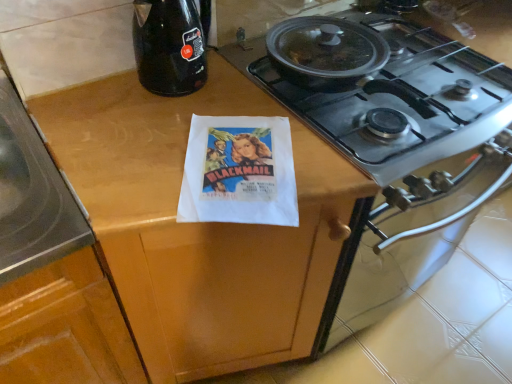
Question: Is black glass bottle at upper left outside wooden at center?

Choices:
 (A) no
 (B) yes

Answer: (B)

Question: Does black glass bottle at upper left have a lesser height compared to wooden at center?

Choices:
 (A) yes
 (B) no

Answer: (A)

Question: Is black glass bottle at upper left in contact with wooden at center?

Choices:
 (A) no
 (B) yes

Answer: (A)

Question: From the image's perspective, is black glass bottle at upper left on wooden at center?

Choices:
 (A) no
 (B) yes

Answer: (B)

Question: Considering the relative positions of black glass bottle at upper left and wooden at center in the image provided, is black glass bottle at upper left to the left of wooden at center from the viewer's perspective?

Choices:
 (A) yes
 (B) no

Answer: (A)

Question: Is black glass bottle at upper left in front of or behind stainless steel gas stove at upper right in the image?

Choices:
 (A) front
 (B) behind

Answer: (B)

Question: Is black glass bottle at upper left inside or outside of stainless steel gas stove at upper right?

Choices:
 (A) inside
 (B) outside

Answer: (B)

Question: In terms of width, does black glass bottle at upper left look wider or thinner when compared to stainless steel gas stove at upper right?

Choices:
 (A) thin
 (B) wide

Answer: (A)

Question: Based on their sizes in the image, would you say black glass bottle at upper left is bigger or smaller than stainless steel gas stove at upper right?

Choices:
 (A) small
 (B) big

Answer: (A)

Question: Considering the positions of black glass bottle at upper left and white paper flyer at center in the image, is black glass bottle at upper left wider or thinner than white paper flyer at center?

Choices:
 (A) thin
 (B) wide

Answer: (A)

Question: Considering the positions of point (141, 23) and point (287, 134), is point (141, 23) closer or farther from the camera than point (287, 134)?

Choices:
 (A) farther
 (B) closer

Answer: (A)

Question: From a real-world perspective, relative to white paper flyer at center, is black glass bottle at upper left vertically above or below?

Choices:
 (A) below
 (B) above

Answer: (B)

Question: In terms of size, does black glass bottle at upper left appear bigger or smaller than white paper flyer at center?

Choices:
 (A) small
 (B) big

Answer: (B)

Question: Looking at their shapes, would you say wooden at center is wider or thinner than black glass bottle at upper left?

Choices:
 (A) wide
 (B) thin

Answer: (A)

Question: Relative to black glass bottle at upper left, is wooden at center in front or behind?

Choices:
 (A) behind
 (B) front

Answer: (B)